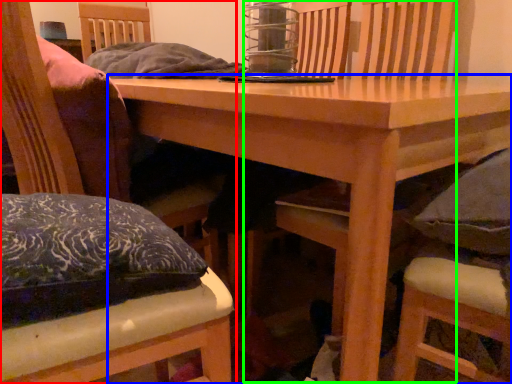
Question: Considering the real-world distances, which object is closest to chair (highlighted by a red box)? table (highlighted by a blue box) or armchair (highlighted by a green box).

Choices:
 (A) table
 (B) armchair

Answer: (A)